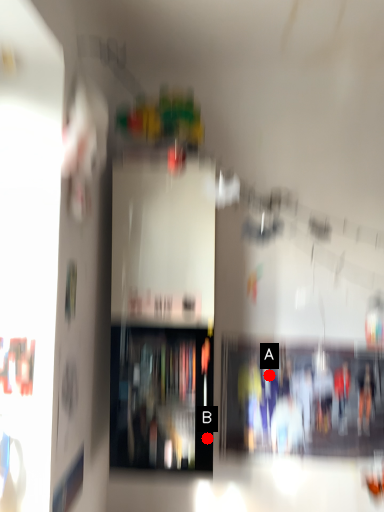
Question: Two points are circled on the image, labeled by A and B beside each circle. Which of the following is the closest to the observer?

Choices:
 (A) A is closer
 (B) B is closer

Answer: (B)